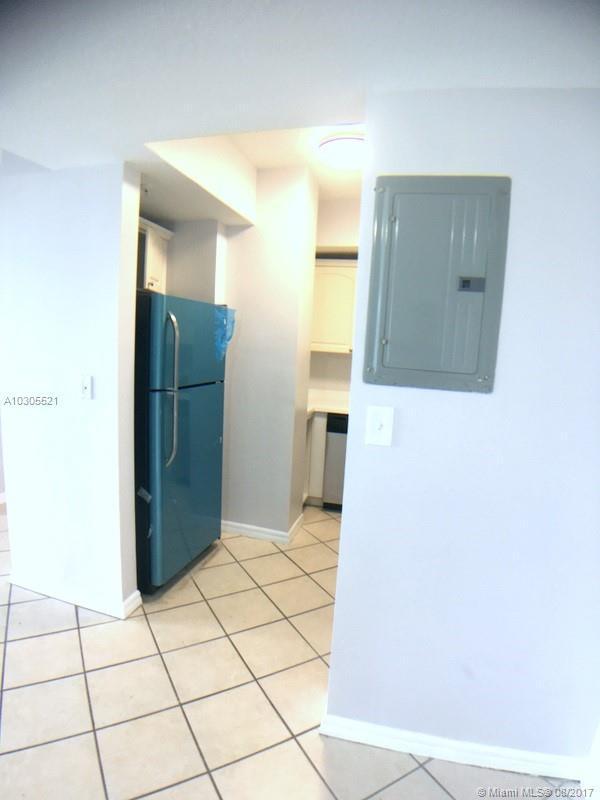
At what (x,y) coordinates should I click in order to perform the action: click on light. Please return your answer as a coordinate pair (x, y). The width and height of the screenshot is (600, 800). Looking at the image, I should click on (347, 160).